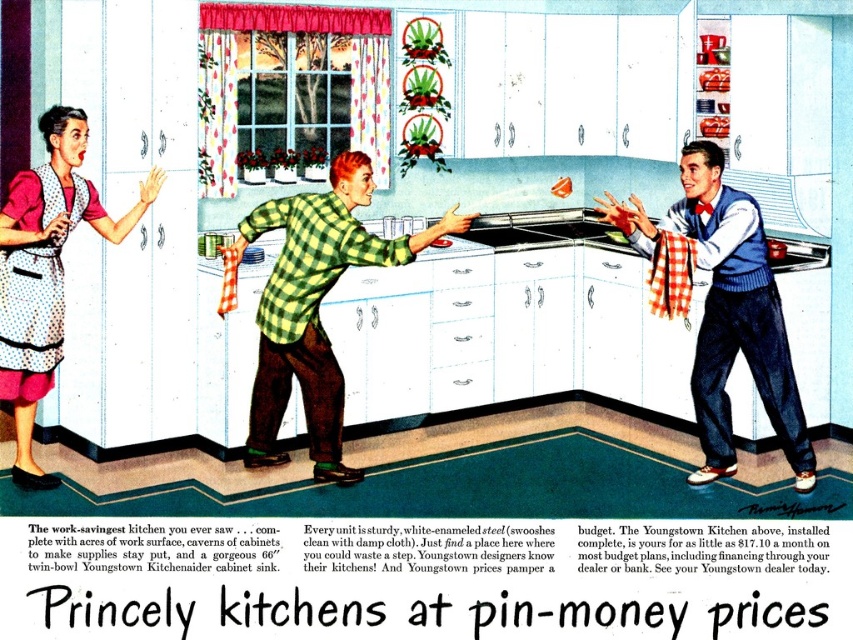
Question: Which point is farther to the camera?

Choices:
 (A) (9, 340)
 (B) (305, 268)
 (C) (4, 268)
 (D) (724, 396)

Answer: (D)

Question: Can you confirm if green plaid shirt at center is thinner than white dotted fabric apron at left?

Choices:
 (A) yes
 (B) no

Answer: (B)

Question: Which of the following is the closest to the observer?

Choices:
 (A) (347, 476)
 (B) (30, 250)
 (C) (712, 356)

Answer: (B)

Question: From the image, what is the correct spatial relationship of green plaid shirt at center in relation to polka dot apron at left?

Choices:
 (A) right
 (B) left

Answer: (A)

Question: Is green plaid shirt at center thinner than polka dot apron at left?

Choices:
 (A) yes
 (B) no

Answer: (B)

Question: Which of these objects is positioned farthest from the polka dot apron at left?

Choices:
 (A) white dotted fabric apron at left
 (B) green plaid shirt at center

Answer: (B)